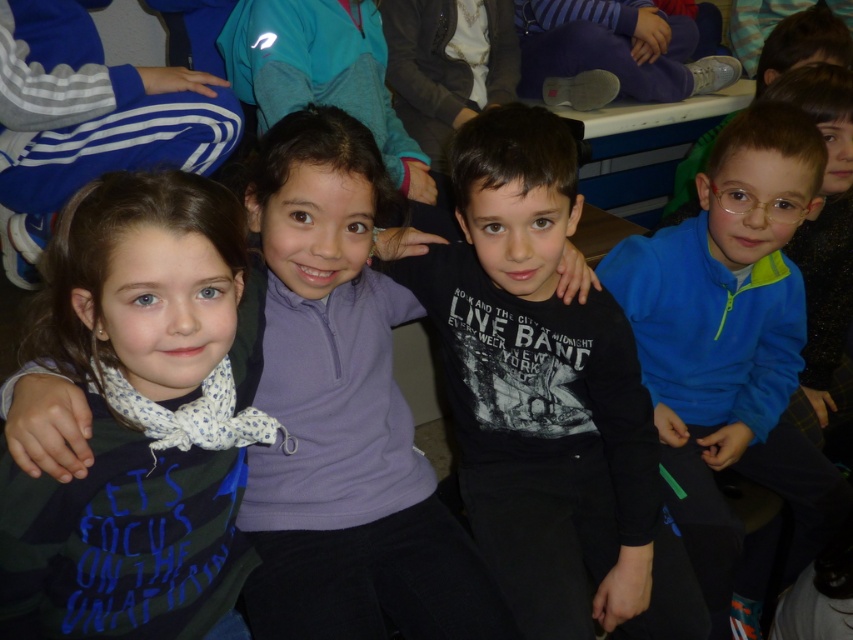
Question: Which object appears closest to the camera in this image?

Choices:
 (A) camouflage fabric shirt at left
 (B) black matte shirt at center

Answer: (A)

Question: Which object is closer to the camera taking this photo?

Choices:
 (A) black matte shirt at center
 (B) camouflage fabric shirt at left

Answer: (B)

Question: Which is farther from the blue fleece jacket at right?

Choices:
 (A) camouflage fabric shirt at left
 (B) black matte shirt at center

Answer: (A)

Question: From the image, what is the correct spatial relationship of black matte shirt at center in relation to camouflage fabric shirt at left?

Choices:
 (A) above
 (B) below

Answer: (B)

Question: Is camouflage fabric shirt at left to the left of blue fleece jacket at right from the viewer's perspective?

Choices:
 (A) no
 (B) yes

Answer: (B)

Question: Does camouflage fabric shirt at left have a larger size compared to blue fleece jacket at right?

Choices:
 (A) no
 (B) yes

Answer: (A)